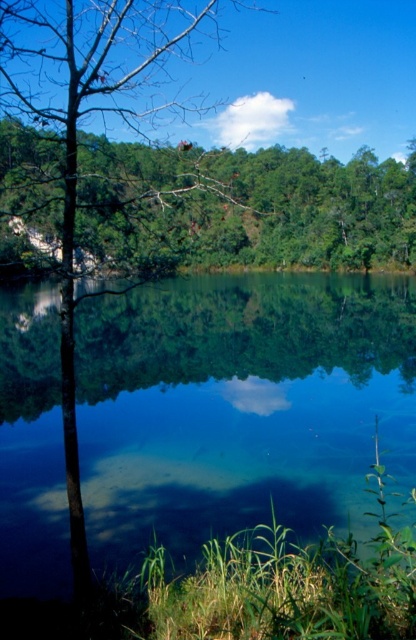
Based on the photo, can you confirm if green matte tree at upper center is wider than smooth bark tree at center?

Indeed, green matte tree at upper center has a greater width compared to smooth bark tree at center.

Based on the photo, is green matte tree at upper center to the left of smooth bark tree at center from the viewer's perspective?

Incorrect, green matte tree at upper center is not on the left side of smooth bark tree at center.

Is point (408, 218) positioned before point (37, 16)?

No, (408, 218) is further to viewer.

This screenshot has width=416, height=640. Identify the location of green matte tree at upper center. (244, 208).

The width and height of the screenshot is (416, 640). Describe the element at coordinates (240, 404) in the screenshot. I see `clear glass water at center` at that location.

Is clear glass water at center taller than green matte tree at upper center?

Incorrect, clear glass water at center's height is not larger of green matte tree at upper center's.

Is point (274, 340) closer to camera compared to point (153, 154)?

Yes, it is in front of point (153, 154).

Find the location of a particular element. Image resolution: width=416 pixels, height=640 pixels. clear glass water at center is located at coordinates (240, 404).

Can you confirm if clear glass water at center is wider than smooth bark tree at center?

Correct, the width of clear glass water at center exceeds that of smooth bark tree at center.

Is point (192, 348) more distant than point (66, 268)?

Yes, it is.

Locate an element on the screen. The height and width of the screenshot is (640, 416). clear glass water at center is located at coordinates (240, 404).